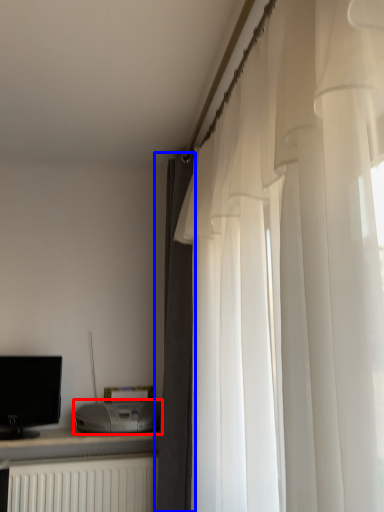
Question: Which of the following is the closest to the observer, appliance (highlighted by a red box) or curtain (highlighted by a blue box)?

Choices:
 (A) appliance
 (B) curtain

Answer: (B)